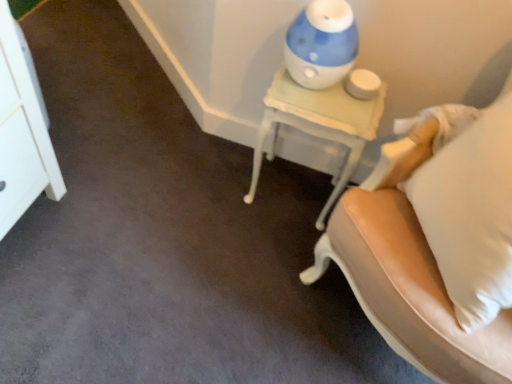
Find the location of a particular element. free space in front of blue plastic humidifier at upper right is located at coordinates (318, 109).